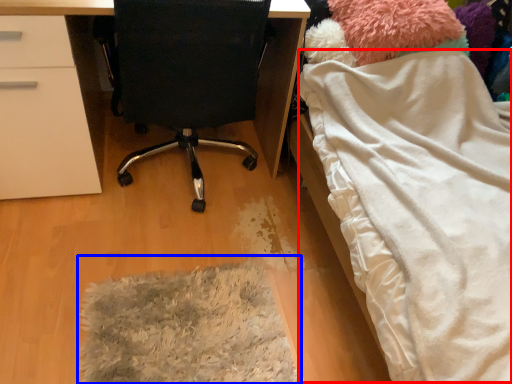
Question: Which object appears closest to the camera in this image, blanket (highlighted by a red box) or mat (highlighted by a blue box)?

Choices:
 (A) blanket
 (B) mat

Answer: (A)